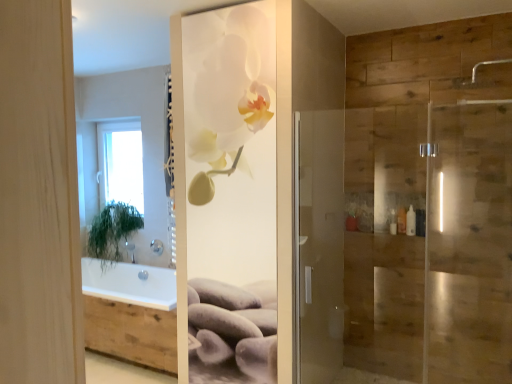
Find the location of a particular element. blank space situated above white glass window at upper left (from a real-world perspective) is located at coordinates (116, 121).